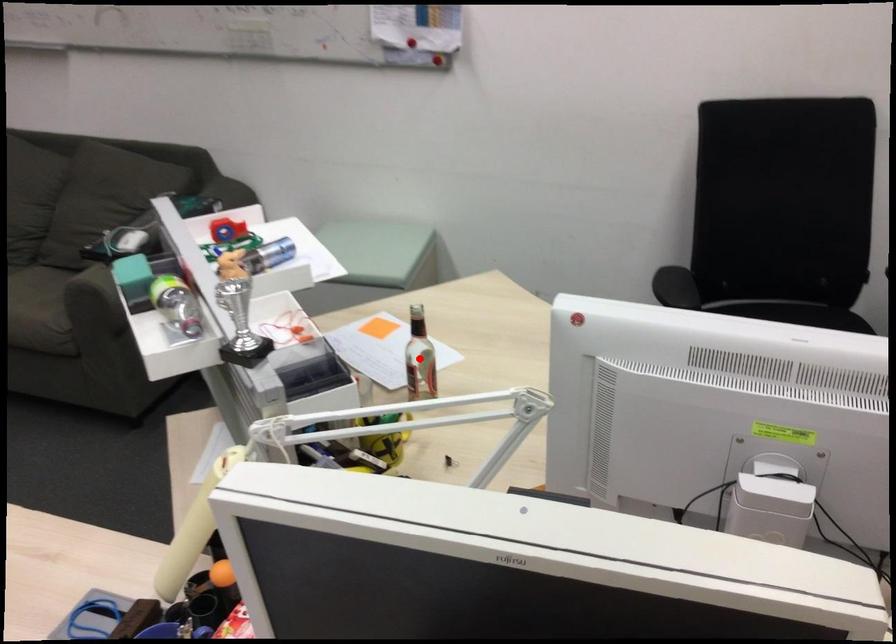
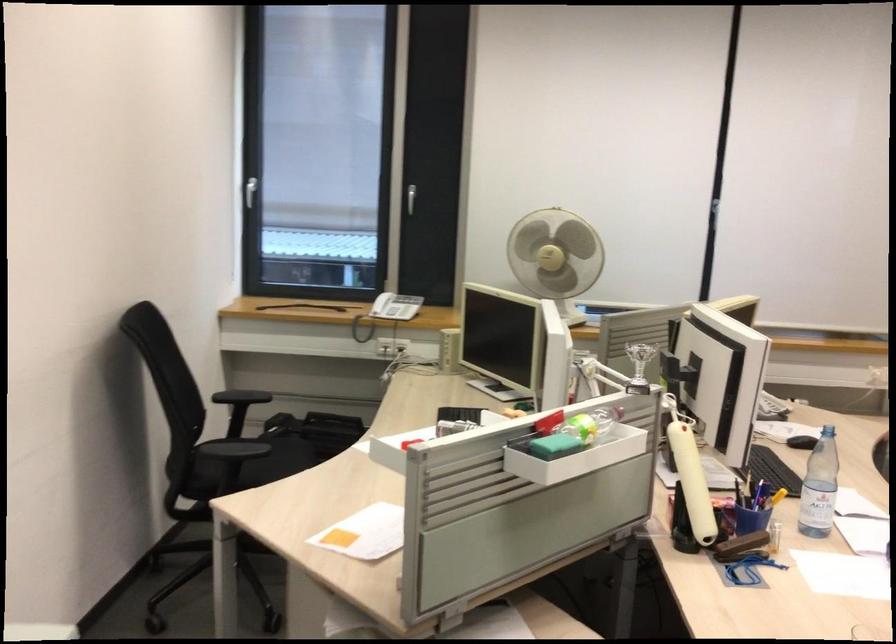
Question: I am providing you with two images of the same scene from different viewpoints. A red point is marked on the first image. Can you still see the location of the red point in image 2?

Choices:
 (A) Yes
 (B) No

Answer: (B)